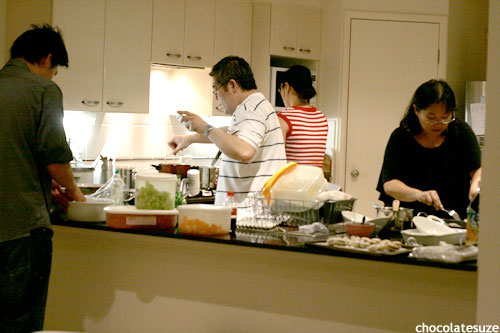
Locate an element on the screen. The width and height of the screenshot is (500, 333). door knob is located at coordinates (355, 173).